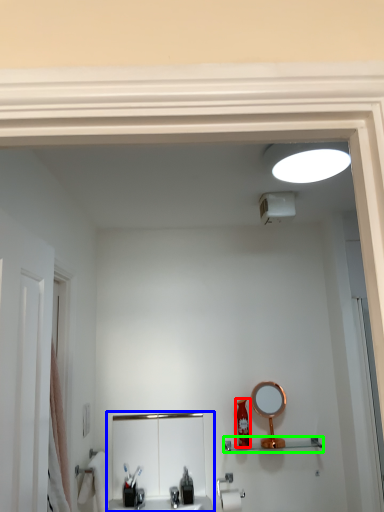
Question: Which object is the closest to the toiletry (highlighted by a red box)? Choose among these: sink (highlighted by a blue box) or shelve (highlighted by a green box).

Choices:
 (A) sink
 (B) shelve

Answer: (B)